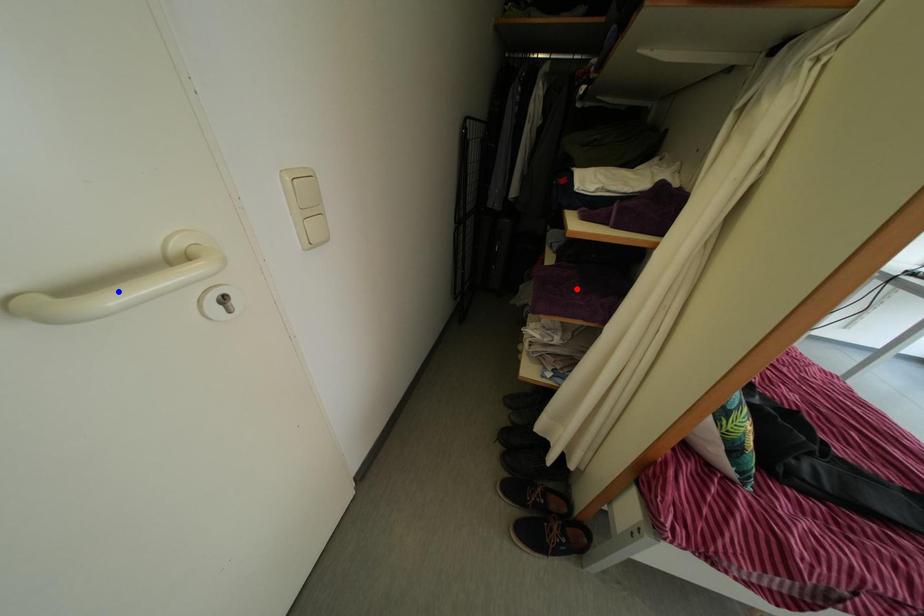
Question: In the image, two points are highlighted. Which point is nearer to the camera? Reply with the corresponding letter.

Choices:
 (A) blue point
 (B) red point

Answer: (A)